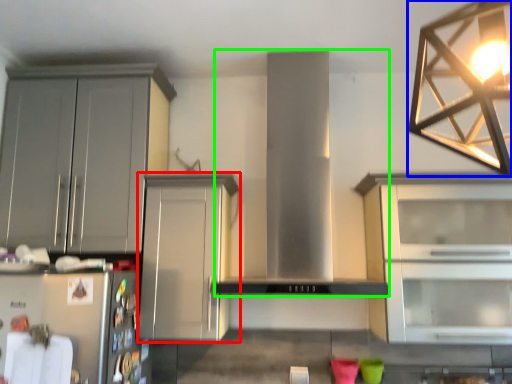
Question: Based on their relative distances, which object is nearer to cabinetry (highlighted by a red box)? Choose from lamp (highlighted by a blue box) and hood (highlighted by a green box).

Choices:
 (A) lamp
 (B) hood

Answer: (B)